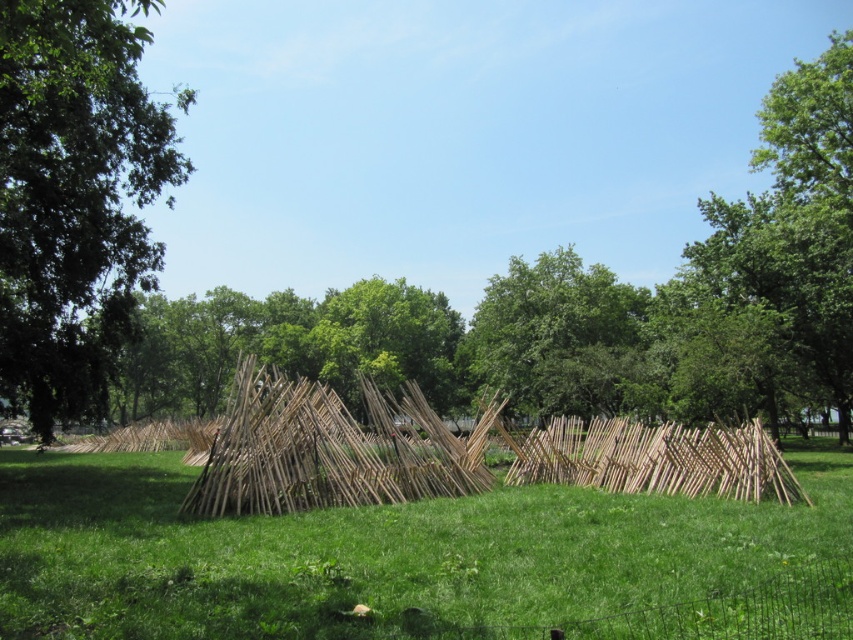
Question: Which point is farther to the camera?

Choices:
 (A) (100, 26)
 (B) (364, 502)
 (C) (654, 579)

Answer: (B)

Question: Which point appears closest to the camera in this image?

Choices:
 (A) [x=601, y=394]
 (B) [x=280, y=513]
 (C) [x=94, y=310]
 (D) [x=219, y=634]

Answer: (D)

Question: Is green grassy at center smaller than natural wood reed at center?

Choices:
 (A) yes
 (B) no

Answer: (A)

Question: Among these points, which one is farthest from the camera?

Choices:
 (A) (515, 403)
 (B) (332, 481)
 (C) (12, 308)
 (D) (123, 458)

Answer: (A)

Question: Considering the relative positions of green grassy at center and green leafy tree at center in the image provided, where is green grassy at center located with respect to green leafy tree at center?

Choices:
 (A) left
 (B) right

Answer: (A)

Question: Does green grassy at center have a larger size compared to natural wood reed at center?

Choices:
 (A) yes
 (B) no

Answer: (B)